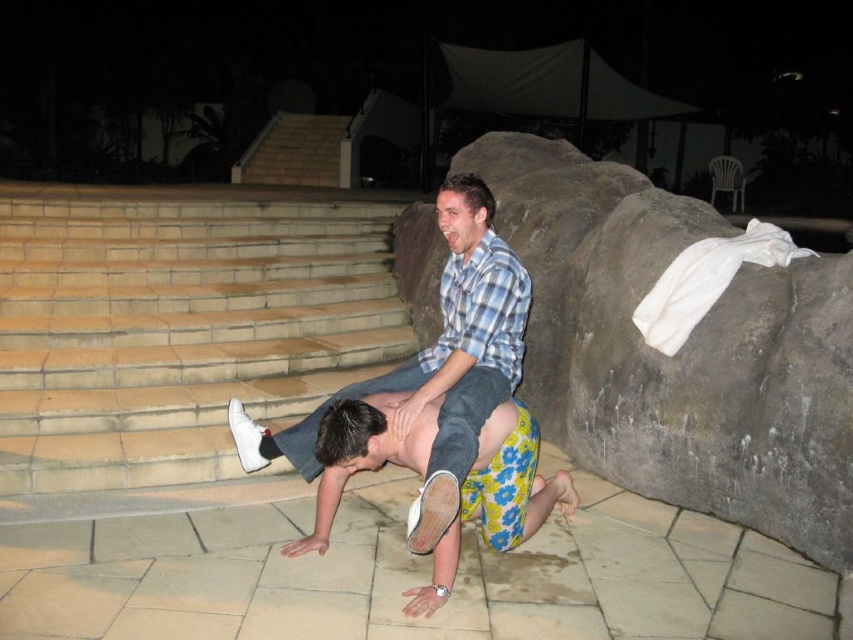
You are standing at the poolside and want to place a small decoration between the two points labeled point (279, 243) and point (445, 188). Which point is closer to you so you can start placing the decoration from there?

Point (279, 243) is closer to you than point (445, 188), so you should start placing the decoration from point (279, 243).

You are standing at the poolside and want to place a small decorative item at the point closer to the pool edge. Which point should you choose between point (413, 372) and point (538, 515)?

Point (413, 372) is in front of point (538, 515), so it is closer to the pool edge. You should choose point (413, 372).